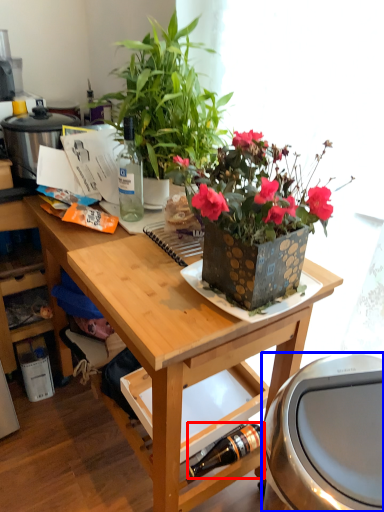
Question: Which object is further to the camera taking this photo, bottle (highlighted by a red box) or appliance (highlighted by a blue box)?

Choices:
 (A) bottle
 (B) appliance

Answer: (A)